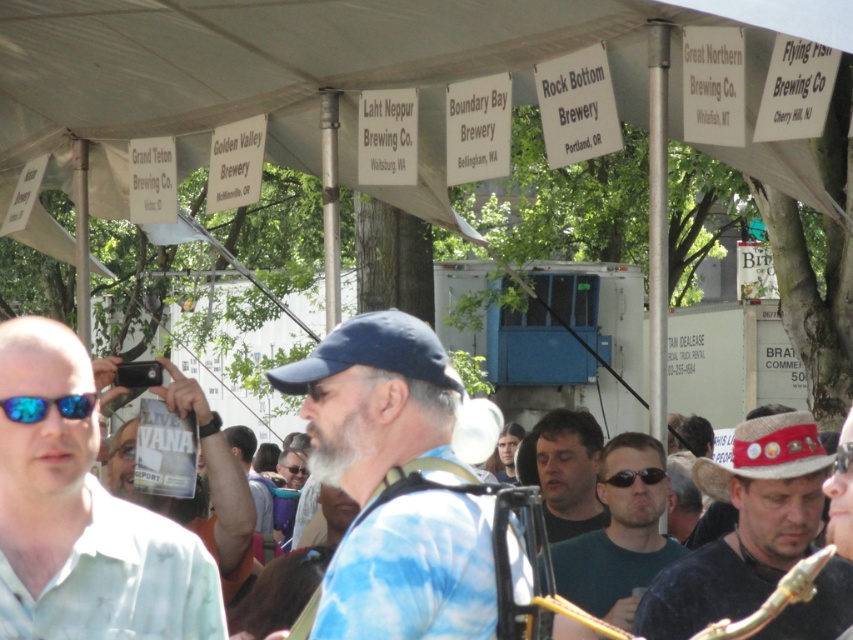
Question: Does white matte shirt at left have a greater width compared to blue fabric baseball cap at center?

Choices:
 (A) yes
 (B) no

Answer: (A)

Question: Which object is farther from the camera taking this photo?

Choices:
 (A) blue reflective lens sunglasses at lower left
 (B) straw hat with red band at lower right
 (C) white matte shirt at left

Answer: (B)

Question: In this image, where is white matte shirt at left located relative to blue reflective lens sunglasses at lower left?

Choices:
 (A) left
 (B) right

Answer: (B)

Question: Which is nearer to the white matte shirt at left?

Choices:
 (A) dark green t-shirt at center
 (B) blue reflective lens sunglasses at lower left
 (C) black plastic sunglasses at center

Answer: (B)

Question: Which of these objects is positioned farthest from the dark green t-shirt at center?

Choices:
 (A) blue fabric baseball cap at center
 (B) straw hat with red band at lower right

Answer: (A)

Question: Does reddish-brown straw hat at center-right appear on the right side of straw hat with red band at lower right?

Choices:
 (A) yes
 (B) no

Answer: (B)